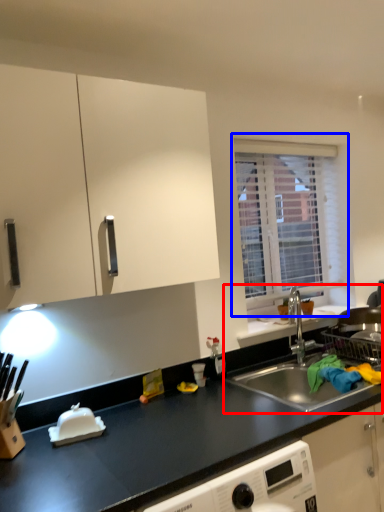
Question: Which object appears closest to the camera in this image, sink (highlighted by a red box) or window (highlighted by a blue box)?

Choices:
 (A) sink
 (B) window

Answer: (A)